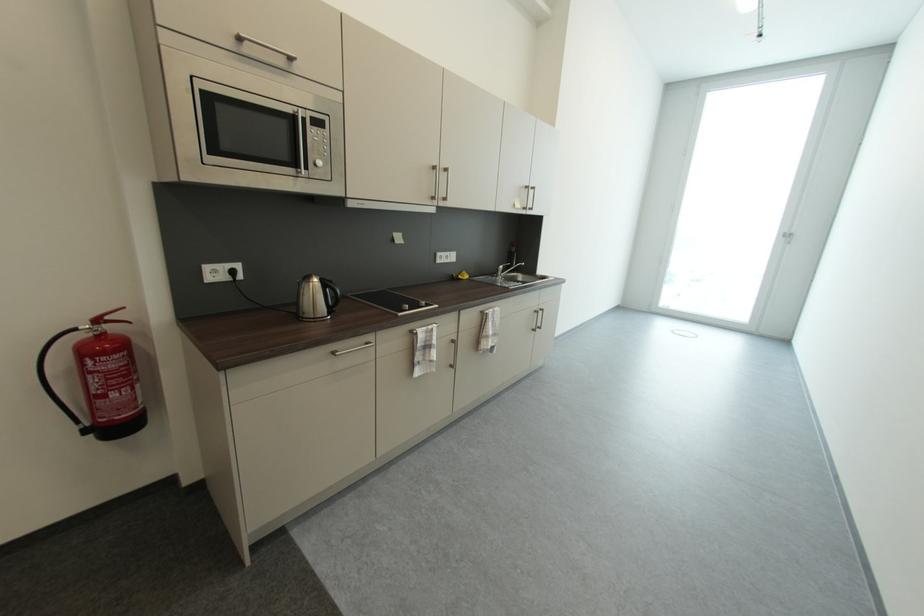
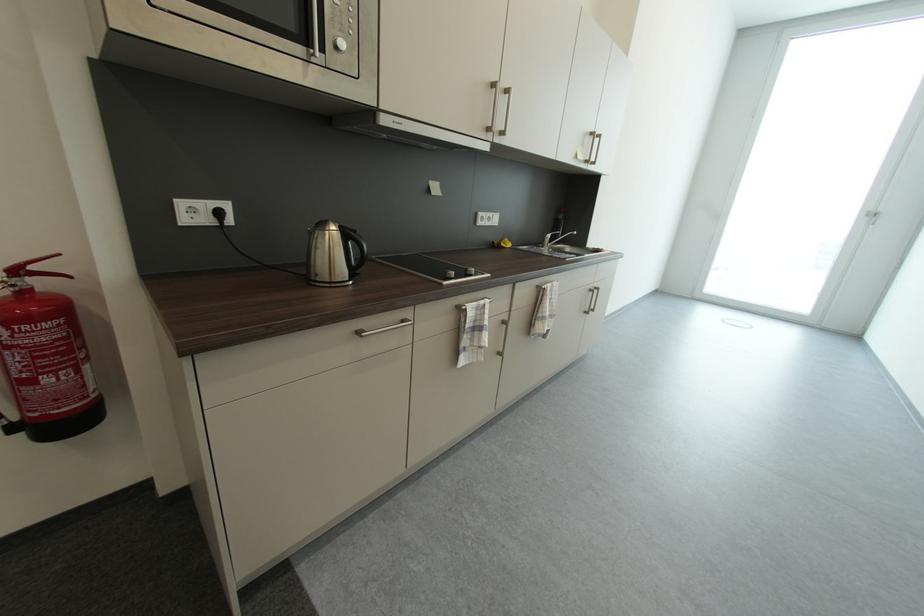
The point at (324, 156) is marked in the first image. Where is the corresponding point in the second image?

(347, 33)